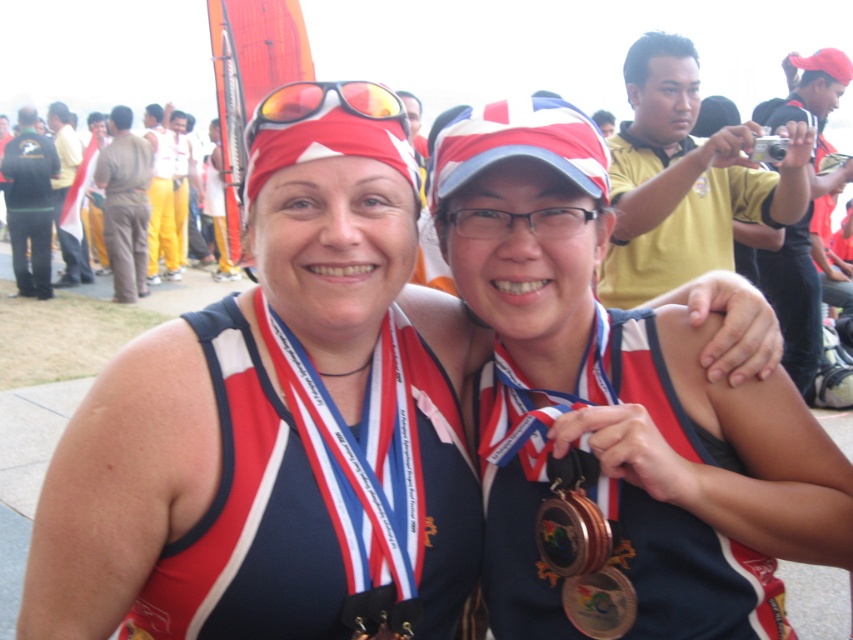
Question: Does matte red swimsuit at center have a lesser width compared to shiny gold medal at center?

Choices:
 (A) no
 (B) yes

Answer: (A)

Question: Where is matte red swimsuit at center located in relation to yellow matte camera at upper right in the image?

Choices:
 (A) above
 (B) below

Answer: (B)

Question: Estimate the real-world distances between objects in this image. Which object is closer to the matte red swimsuit at center?

Choices:
 (A) yellow matte camera at upper right
 (B) shiny gold medal at center
 (C) matte plastic goggles at center
 (D) shiny orange goggles at upper center

Answer: (B)

Question: Which of the following is the closest to the observer?

Choices:
 (A) yellow matte camera at upper right
 (B) shiny gold medal at center
 (C) matte plastic goggles at center

Answer: (B)

Question: Estimate the real-world distances between objects in this image. Which object is closer to the yellow matte camera at upper right?

Choices:
 (A) matte plastic goggles at center
 (B) shiny gold medal at center
 (C) shiny orange goggles at upper center

Answer: (B)

Question: Does bronze metallic medal at center appear under matte plastic goggles at center?

Choices:
 (A) yes
 (B) no

Answer: (A)